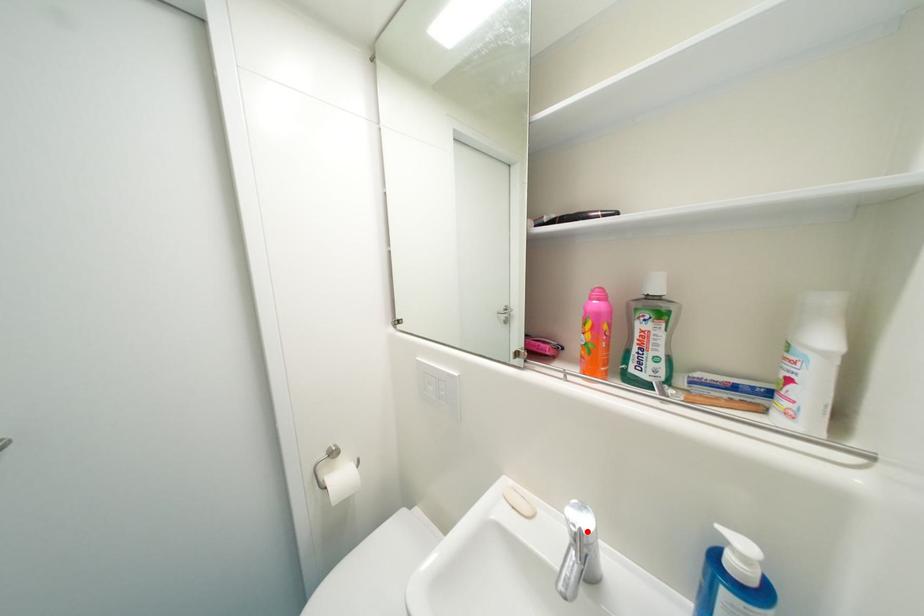
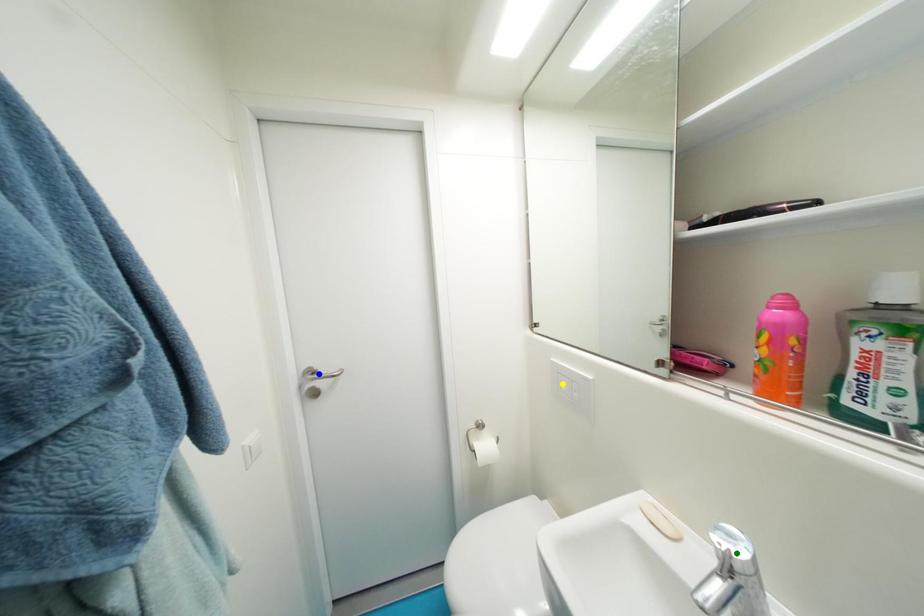
Question: I am providing you with two images of the same scene from different viewpoints. A red point is marked on the first image. You are given multiple points on the second image. Which spot in image 2 lines up with the point in image 1?

Choices:
 (A) yellow point
 (B) blue point
 (C) green point

Answer: (C)